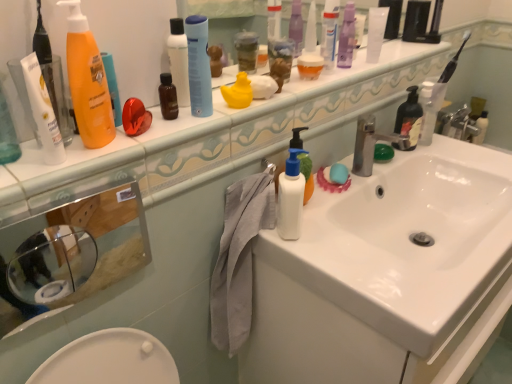
The image size is (512, 384). Identify the location of vacant area that lies in front of white matte plastic bottle at center. (333, 264).